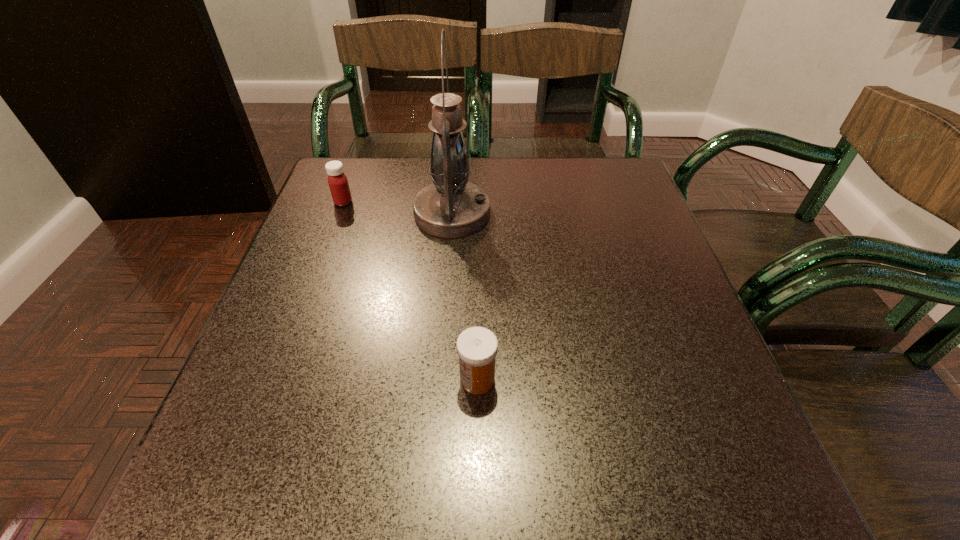
Where is `free spot that satisfies the following two spatial constraints: 1. on the front side of the oil lamp; 2. on the left side of the leftmost object`? free spot that satisfies the following two spatial constraints: 1. on the front side of the oil lamp; 2. on the left side of the leftmost object is located at coordinates (339, 213).

Find the location of a particular element. free location that satisfies the following two spatial constraints: 1. on the front side of the farther medicine; 2. on the left side of the tallest object is located at coordinates (339, 213).

This screenshot has width=960, height=540. Identify the location of vacant space that satisfies the following two spatial constraints: 1. on the front side of the left medicine; 2. on the left side of the nearer medicine. (277, 379).